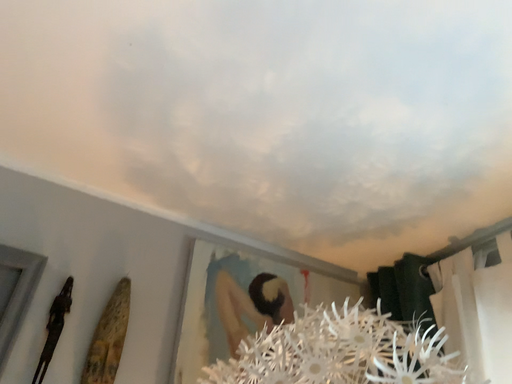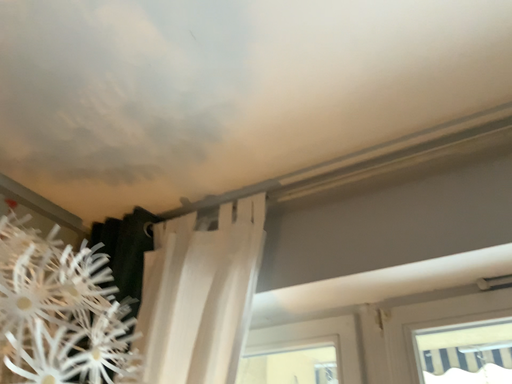
Question: Which way did the camera rotate in the video?

Choices:
 (A) rotated right
 (B) rotated left

Answer: (A)